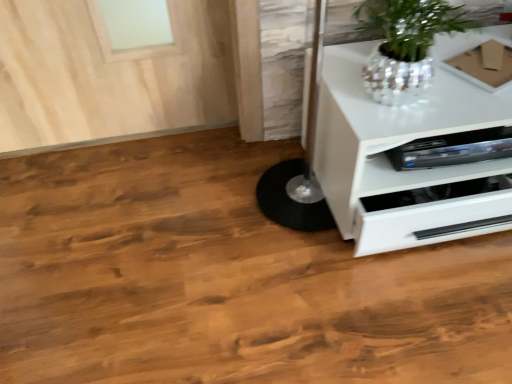
What do you see at coordinates (483, 66) in the screenshot? Image resolution: width=512 pixels, height=384 pixels. I see `brown cardboard box at upper right` at bounding box center [483, 66].

I want to click on white glossy chest of drawers at lower right, so click(404, 143).

Describe the element at coordinates (404, 143) in the screenshot. Image resolution: width=512 pixels, height=384 pixels. I see `white glossy chest of drawers at lower right` at that location.

Where is `brown cardboard box at upper right`? This screenshot has width=512, height=384. brown cardboard box at upper right is located at coordinates (483, 66).

Can you confirm if shiny metallic pot at upper right is bigger than brown cardboard box at upper right?

Correct, shiny metallic pot at upper right is larger in size than brown cardboard box at upper right.

From the image's perspective, is shiny metallic pot at upper right above or below brown cardboard box at upper right?

Based on their image positions, shiny metallic pot at upper right is located beneath brown cardboard box at upper right.

Find the location of `cardboard box below the shiny metallic pot at upper right (from a real-world perspective)`. cardboard box below the shiny metallic pot at upper right (from a real-world perspective) is located at coordinates (483, 66).

Is white glossy chest of drawers at lower right aimed at brown cardboard box at upper right?

No, white glossy chest of drawers at lower right is not aimed at brown cardboard box at upper right.

Who is bigger, white glossy chest of drawers at lower right or brown cardboard box at upper right?

white glossy chest of drawers at lower right is bigger.

Which of these two, white glossy chest of drawers at lower right or brown cardboard box at upper right, is wider?

white glossy chest of drawers at lower right is wider.

Measure the distance between white glossy chest of drawers at lower right and brown cardboard box at upper right.

The distance of white glossy chest of drawers at lower right from brown cardboard box at upper right is 9.59 inches.

Looking at their sizes, would you say brown cardboard box at upper right is wider or thinner than shiny metallic pot at upper right?

In the image, brown cardboard box at upper right appears to be more narrow than shiny metallic pot at upper right.

From a real-world perspective, who is located lower, brown cardboard box at upper right or shiny metallic pot at upper right?

brown cardboard box at upper right.

How many degrees apart are the facing directions of brown cardboard box at upper right and shiny metallic pot at upper right?

brown cardboard box at upper right and shiny metallic pot at upper right are facing 24 degrees away from each other.

Looking at this image, which is behind, brown cardboard box at upper right or shiny metallic pot at upper right?

brown cardboard box at upper right.

Considering the relative sizes of brown cardboard box at upper right and white glossy chest of drawers at lower right in the image provided, is brown cardboard box at upper right thinner than white glossy chest of drawers at lower right?

Result: Indeed, brown cardboard box at upper right has a lesser width compared to white glossy chest of drawers at lower right.

Is the surface of brown cardboard box at upper right in direct contact with white glossy chest of drawers at lower right?

They are not placed beside each other.

Considering the positions of objects brown cardboard box at upper right and white glossy chest of drawers at lower right in the image provided, who is in front, brown cardboard box at upper right or white glossy chest of drawers at lower right?

white glossy chest of drawers at lower right is closer to the camera.

Is brown cardboard box at upper right outside of white glossy chest of drawers at lower right?

No, brown cardboard box at upper right is inside white glossy chest of drawers at lower right's boundary.

Is point (446, 73) behind point (401, 56)?

Yes, it is.

From the image's perspective, is white glossy chest of drawers at lower right positioned above or below shiny metallic pot at upper right?

From the image's perspective, white glossy chest of drawers at lower right appears below shiny metallic pot at upper right.

Can you confirm if white glossy chest of drawers at lower right is bigger than shiny metallic pot at upper right?

Yes, white glossy chest of drawers at lower right is bigger than shiny metallic pot at upper right.

Could you tell me if white glossy chest of drawers at lower right is turned towards shiny metallic pot at upper right?

No, white glossy chest of drawers at lower right is not oriented towards shiny metallic pot at upper right.

Is shiny metallic pot at upper right in front of or behind white glossy chest of drawers at lower right in the image?

In the image, shiny metallic pot at upper right appears in front of white glossy chest of drawers at lower right.

Considering the positions of points (368, 14) and (414, 187), is point (368, 14) farther from camera compared to point (414, 187)?

No.

From the image's perspective, which one is positioned lower, shiny metallic pot at upper right or white glossy chest of drawers at lower right?

white glossy chest of drawers at lower right, from the image's perspective.

Where is `cardboard box located above the shiny metallic pot at upper right (from the image's perspective)`? This screenshot has width=512, height=384. cardboard box located above the shiny metallic pot at upper right (from the image's perspective) is located at coordinates pyautogui.click(x=483, y=66).

Locate an element on the screen. This screenshot has height=384, width=512. cardboard box that is behind the white glossy chest of drawers at lower right is located at coordinates (483, 66).

Considering their positions, is brown cardboard box at upper right positioned closer to shiny metallic pot at upper right than white glossy chest of drawers at lower right?

The object closer to shiny metallic pot at upper right is white glossy chest of drawers at lower right.

Based on the photo, from the image, which object appears to be farther from brown cardboard box at upper right, shiny metallic pot at upper right or white glossy chest of drawers at lower right?

The object further to brown cardboard box at upper right is white glossy chest of drawers at lower right.

Considering their positions, is brown cardboard box at upper right positioned further to white glossy chest of drawers at lower right than shiny metallic pot at upper right?

brown cardboard box at upper right.

Based on their spatial positions, is shiny metallic pot at upper right or brown cardboard box at upper right closer to white glossy chest of drawers at lower right?

shiny metallic pot at upper right is closer to white glossy chest of drawers at lower right.

Based on their spatial positions, is white glossy chest of drawers at lower right or brown cardboard box at upper right further from shiny metallic pot at upper right?

The object further to shiny metallic pot at upper right is brown cardboard box at upper right.

Which object lies nearer to the anchor point brown cardboard box at upper right, white glossy chest of drawers at lower right or shiny metallic pot at upper right?

shiny metallic pot at upper right.

What are the coordinates of `the chest of drawers situated between shiny metallic pot at upper right and brown cardboard box at upper right from left to right` in the screenshot? It's located at point(404,143).